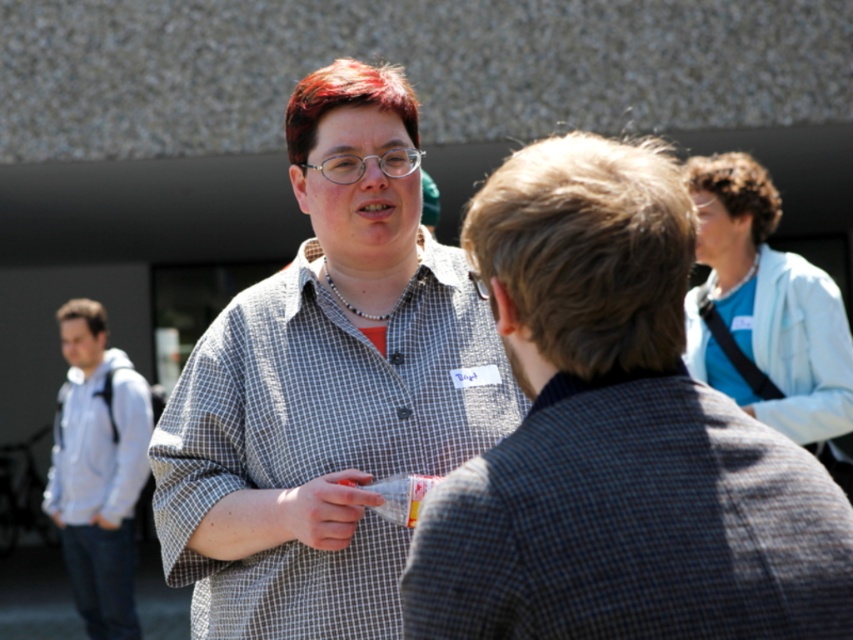
Which is in front, point (248, 586) or point (476, 278)?

Point (476, 278) is in front.

You are a GUI agent. You are given a task and a screenshot of the screen. Output one action in this format:
    pyautogui.click(x=<x>, y=<y>)
    Task: Click on the checkered shirt at center
    This screenshot has width=853, height=640.
    Given the screenshot: What is the action you would take?
    pyautogui.click(x=328, y=390)

Is point (515, 628) closer to camera compared to point (708, 234)?

Yes.

Is checkered fabric shirt at center taller than light blue fabric coat at right?

Incorrect, checkered fabric shirt at center's height is not larger of light blue fabric coat at right's.

Which is in front, point (456, 541) or point (717, 173)?

Point (456, 541) is more forward.

Find the location of a particular element. checkered fabric shirt at center is located at coordinates (618, 436).

Does checkered fabric shirt at center appear on the right side of checkered shirt at center?

Result: Indeed, checkered fabric shirt at center is positioned on the right side of checkered shirt at center.

Who is more forward, (x=697, y=524) or (x=311, y=522)?

Point (x=697, y=524) is in front.

Which is in front, point (618, 204) or point (364, 285)?

Point (618, 204) is more forward.

Identify the location of checkered fabric shirt at center. The width and height of the screenshot is (853, 640). (618, 436).